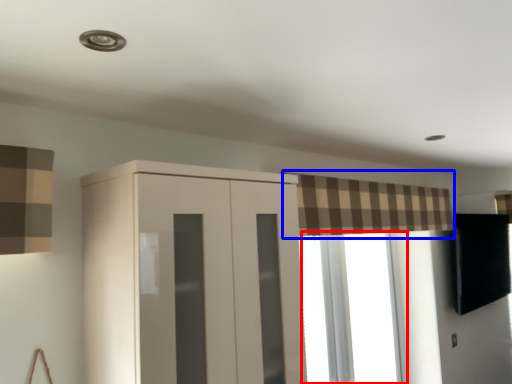
Question: Which point is closer to the camera, window (highlighted by a red box) or curtain (highlighted by a blue box)?

Choices:
 (A) window
 (B) curtain

Answer: (B)